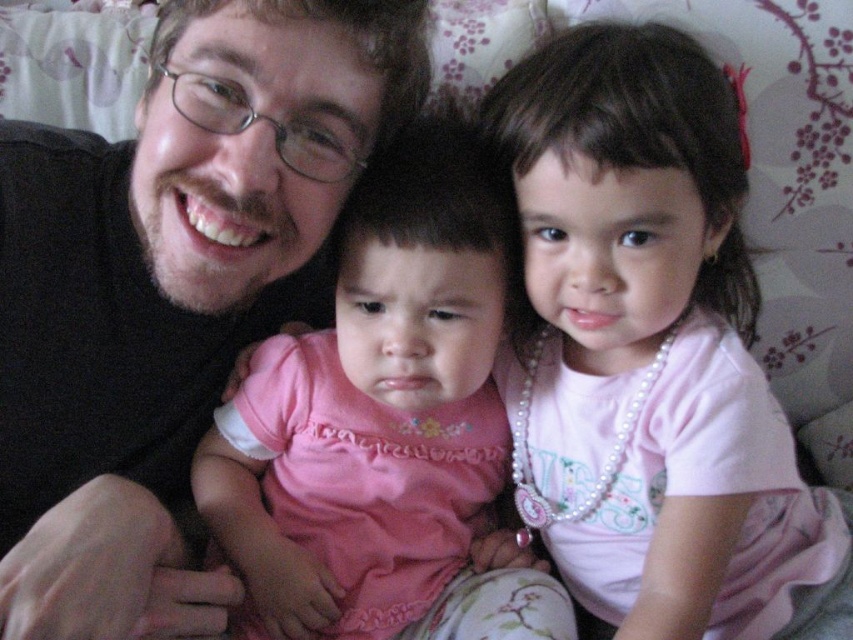
You are a photographer setting up for a family portrait. You need to ensure that the matte black shirt at left and the pink satin dress at center are both visible in the frame. Based on their positions, which object is covering part of the other?

The matte black shirt at left is positioned over the pink satin dress at center, so it is covering part of it.

You are a photographer adjusting your camera to focus on the pearl necklace at upper right. The camera has a focus point at coordinates point [653,353]. Is the focus point correctly positioned to capture the pearl necklace at upper right?

Yes, the focus point at point [653,353] is correctly positioned to capture the pearl necklace at upper right because the Objects Description states that the point corresponds to the pearl necklace at upper right.

You are a photographer trying to focus on the pearl necklace at upper right. Based on the coordinates provided, can you determine if the necklace is positioned in the center of the image?

The pearl necklace at upper right has coordinates at point (x=653, y=353). Since the center of an image is typically at coordinates (x=426, y=320), the necklace is slightly to the right and above the center point, so it is not exactly centered.